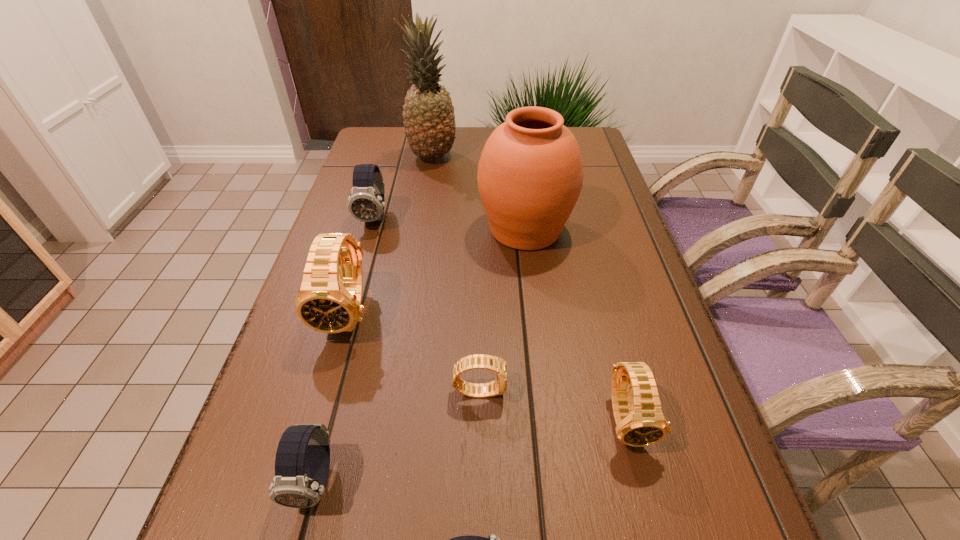
Identify the location of pineapple. (429, 120).

I want to click on the farthest object, so click(429, 120).

In order to click on urn in this screenshot , I will do `click(530, 174)`.

Image resolution: width=960 pixels, height=540 pixels. Identify the location of the sixth shortest object. (329, 301).

This screenshot has height=540, width=960. I want to click on the fifth nearest object, so click(329, 301).

Find the location of a particular element. This screenshot has height=540, width=960. the fourth tallest object is located at coordinates (366, 203).

Find the location of a particular element. The image size is (960, 540). the farthest dark watch is located at coordinates (366, 203).

I want to click on the rightmost black watch, so click(640, 422).

You are a GUI agent. You are given a task and a screenshot of the screen. Output one action in this format:
    pyautogui.click(x=<x>, y=<y>)
    Task: Click on the rightmost watch
    This screenshot has height=540, width=960.
    Given the screenshot: What is the action you would take?
    pyautogui.click(x=640, y=422)

This screenshot has height=540, width=960. Identify the location of the second farthest dark watch. (302, 462).